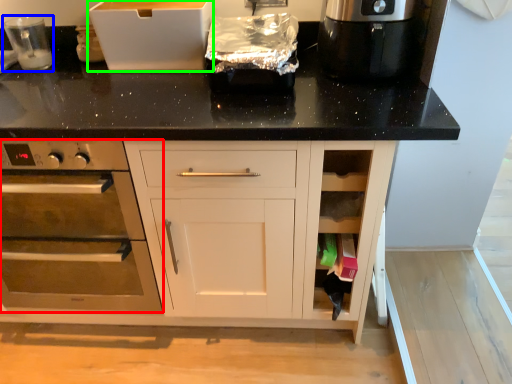
Question: Based on their relative distances, which object is farther from home appliance (highlighted by a red box)? Choose from appliance (highlighted by a blue box) and cardboard box (highlighted by a green box).

Choices:
 (A) appliance
 (B) cardboard box

Answer: (A)